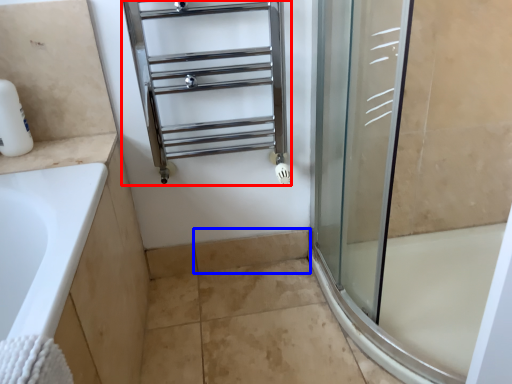
Question: Among these objects, which one is nearest to the camera, shelf (highlighted by a red box) or tile (highlighted by a blue box)?

Choices:
 (A) shelf
 (B) tile

Answer: (A)